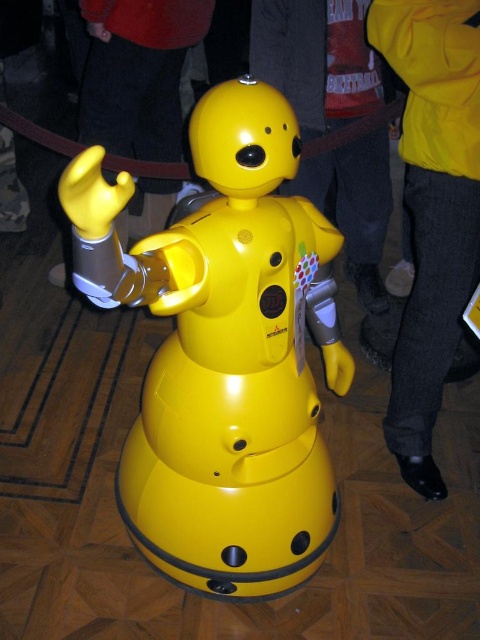
Between yellow matte robot at center and matte yellow robot at center, which one appears on the left side from the viewer's perspective?

From the viewer's perspective, matte yellow robot at center appears more on the left side.

Does yellow matte robot at center come behind matte yellow robot at center?

Yes, it is behind matte yellow robot at center.

Based on the photo, who is more distant from viewer, (283, 88) or (175, 115)?

Positioned behind is point (175, 115).

Locate an element on the screen. The height and width of the screenshot is (640, 480). yellow matte robot at center is located at coordinates (316, 60).

Who is taller, yellow fabric pants at lower right or matte yellow robot at center?

Standing taller between the two is yellow fabric pants at lower right.

Locate an element on the screen. The height and width of the screenshot is (640, 480). yellow fabric pants at lower right is located at coordinates (432, 209).

Where is `matte plastic robot at center`? The width and height of the screenshot is (480, 640). matte plastic robot at center is located at coordinates (219, 353).

Which is above, matte plastic robot at center or yellow matte robot at center?

yellow matte robot at center is higher up.

Where is `matte plastic robot at center`? This screenshot has height=640, width=480. matte plastic robot at center is located at coordinates (219, 353).